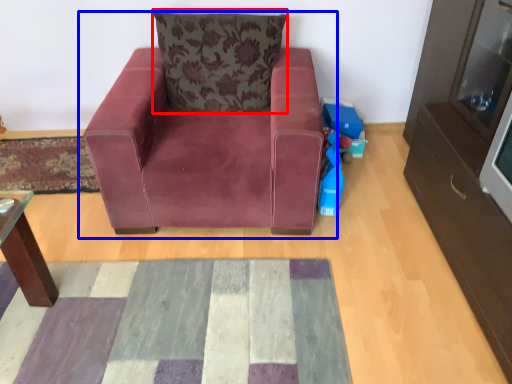
Question: Among these objects, which one is farthest to the camera, pillow (highlighted by a red box) or chair (highlighted by a blue box)?

Choices:
 (A) pillow
 (B) chair

Answer: (A)